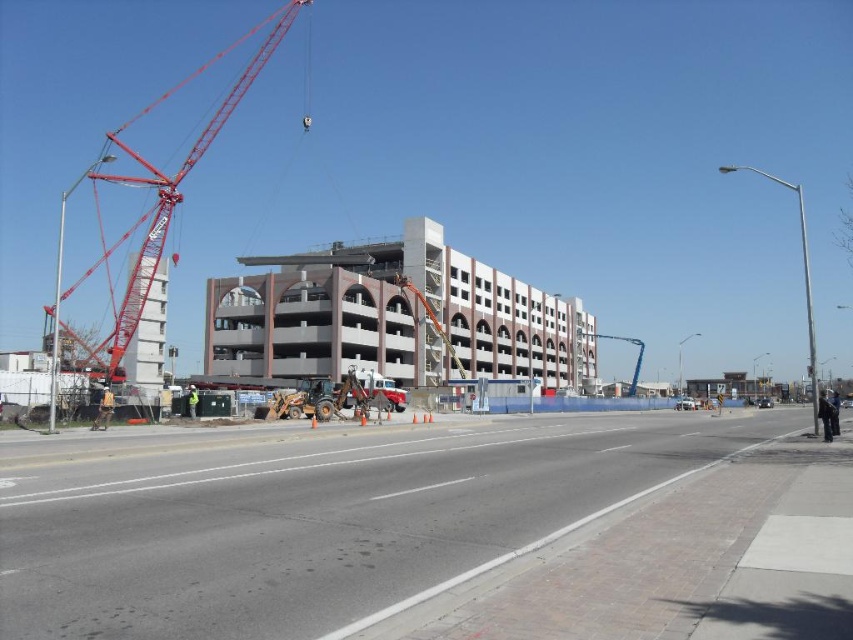
Is point (624, 618) behind point (120, 339)?

No, it is in front of (120, 339).

Based on the photo, does blue concrete construction site at center have a larger size compared to red metallic crane at left?

No, blue concrete construction site at center is not bigger than red metallic crane at left.

Image resolution: width=853 pixels, height=640 pixels. In order to click on blue concrete construction site at center in this screenshot , I will do `click(445, 534)`.

Identify the location of blue concrete construction site at center. (445, 534).